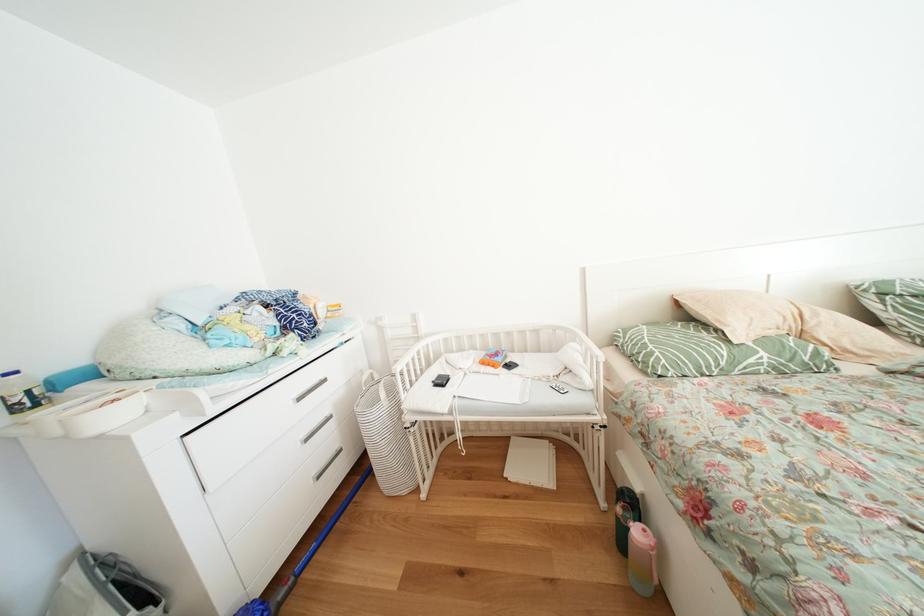
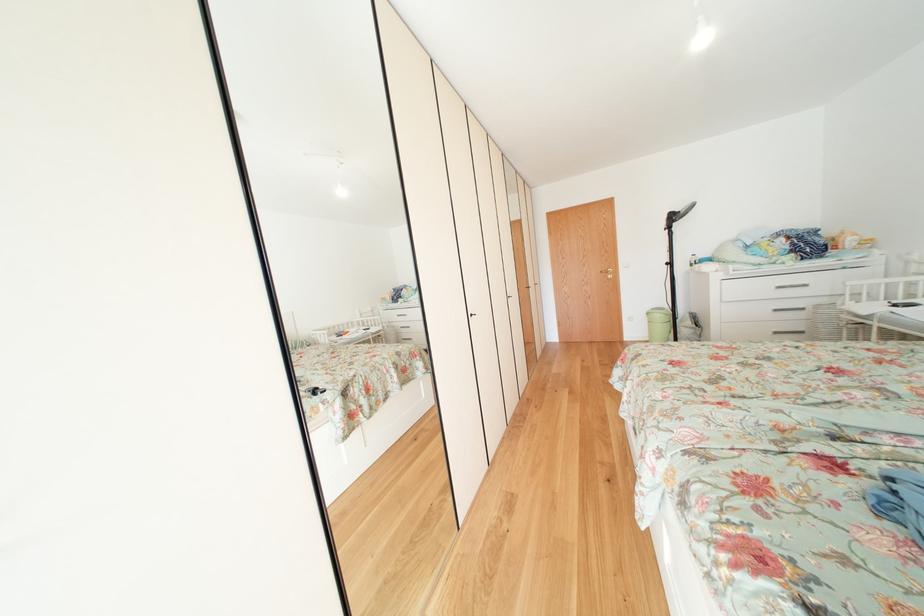
Locate, in the second image, the point that corresponds to (x=329, y=482) in the first image.

(784, 338)